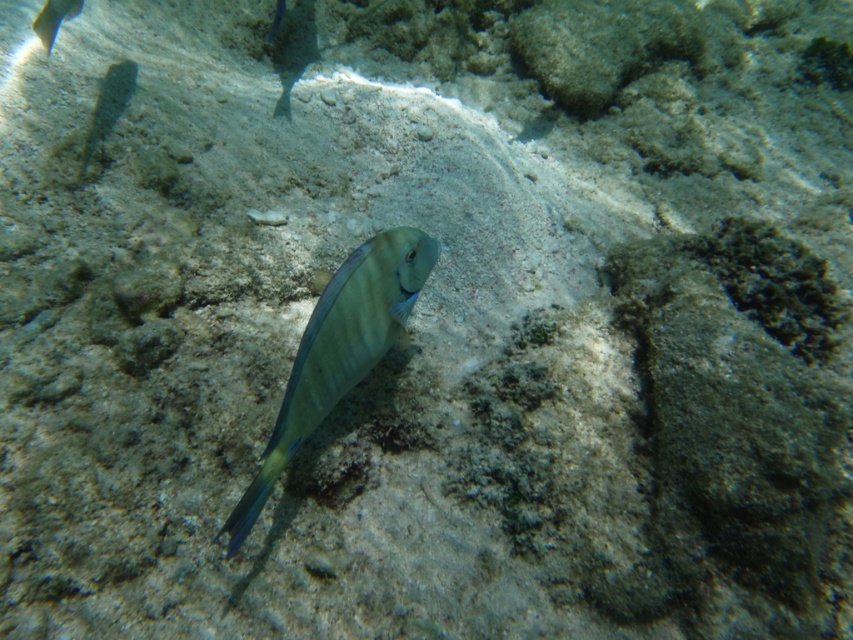
You are an underwater photographer aiming to capture both the shiny blue fish at center and the shiny blue fish at upper left in a single frame. Based on their positions, which fish is positioned to the left when looking from the photographer perspective?

The shiny blue fish at upper left is positioned to the left of the shiny blue fish at center, so the shiny blue fish at upper left would be on the left side in the frame.

You are a diver with a 3.5 feet long snorkel. You want to reach the point marked as point (392, 332) while staying at your current depth. Can your snorkel reach that point without needing to swim closer?

The distance between you and point (392, 332) is 3.61 feet. Since your snorkel is only 3.5 feet long, it cannot reach that point. You would need to swim closer by at least 0.11 feet to make the snorkel long enough.